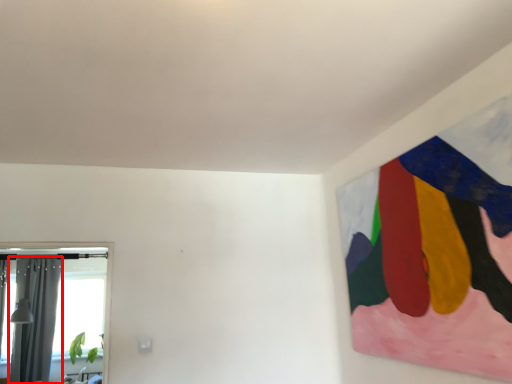
Question: From the image, what is the correct spatial relationship of curtain (annotated by the red box) in relation to window?

Choices:
 (A) left
 (B) right

Answer: (B)